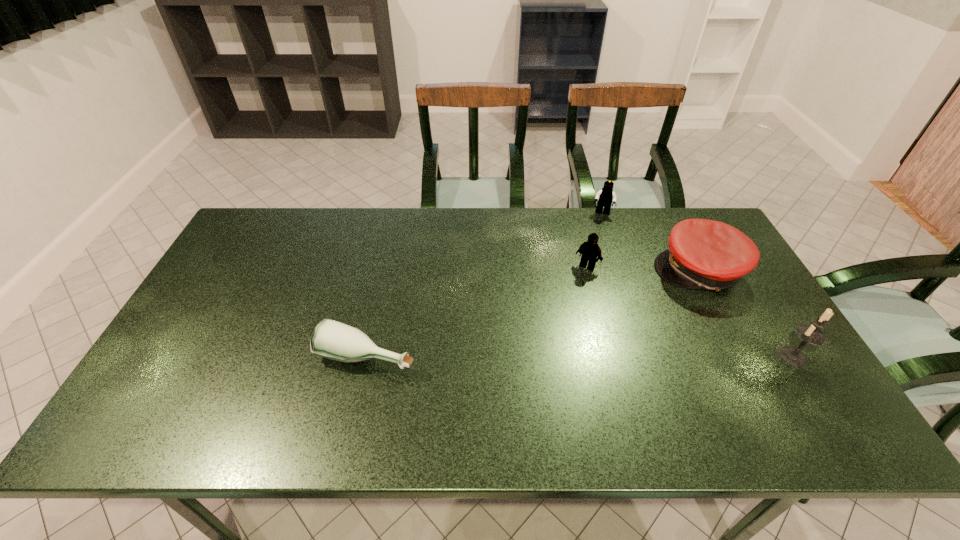
Image resolution: width=960 pixels, height=540 pixels. In order to click on vacant position located 0.160m on the front-facing side of the cap in this screenshot , I will do [x=644, y=318].

Identify the location of free space located 0.130m on the front-facing side of the cap. This screenshot has height=540, width=960. (650, 313).

You are a GUI agent. You are given a task and a screenshot of the screen. Output one action in this format:
    pyautogui.click(x=<x>, y=<y>)
    Task: Click on the vacant space situated 0.280m on the front-facing side of the cap
    This screenshot has width=960, height=540.
    Given the screenshot: What is the action you would take?
    pyautogui.click(x=618, y=341)

Locate an element on the screen. free location located 0.270m on the face of the left Lego is located at coordinates (545, 331).

Identify the location of vacant space located 0.300m on the face of the left Lego. This screenshot has height=540, width=960. (540, 339).

I want to click on vacant region located 0.160m on the face of the left Lego, so click(562, 305).

This screenshot has width=960, height=540. In order to click on vacant space positioned 0.170m on the front-facing side of the farthest object in this screenshot , I will do `click(597, 248)`.

You are a GUI agent. You are given a task and a screenshot of the screen. Output one action in this format:
    pyautogui.click(x=<x>, y=<y>)
    Task: Click on the blank area located 0.160m on the front-facing side of the farthest object
    Image resolution: width=960 pixels, height=540 pixels.
    Given the screenshot: What is the action you would take?
    pyautogui.click(x=598, y=247)

I want to click on vacant space situated on the front-facing side of the farthest object, so [x=594, y=280].

Identify the location of cap that is at the far edge. point(703,254).